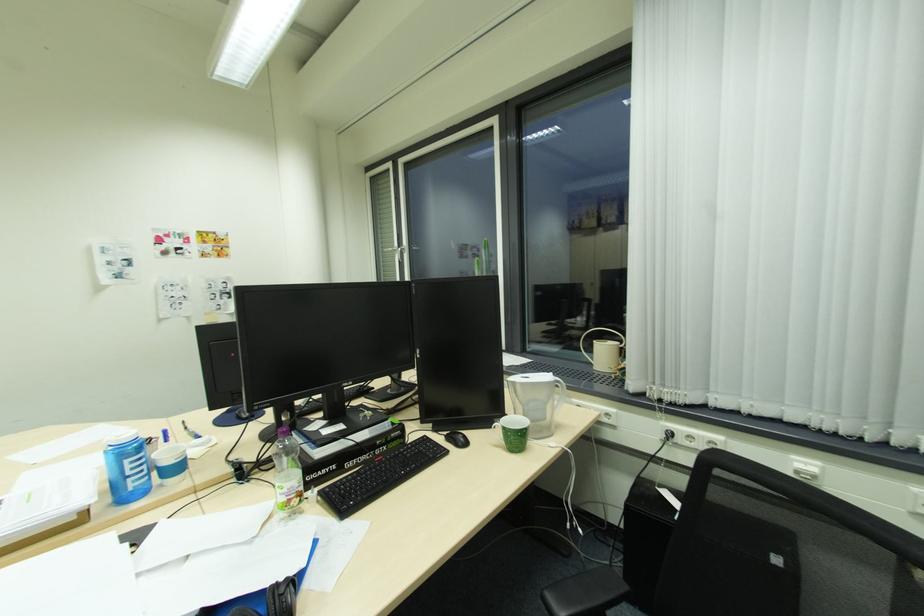
Find the location of a particular element. This screenshot has width=924, height=616. water pitcher handle is located at coordinates [561, 392].